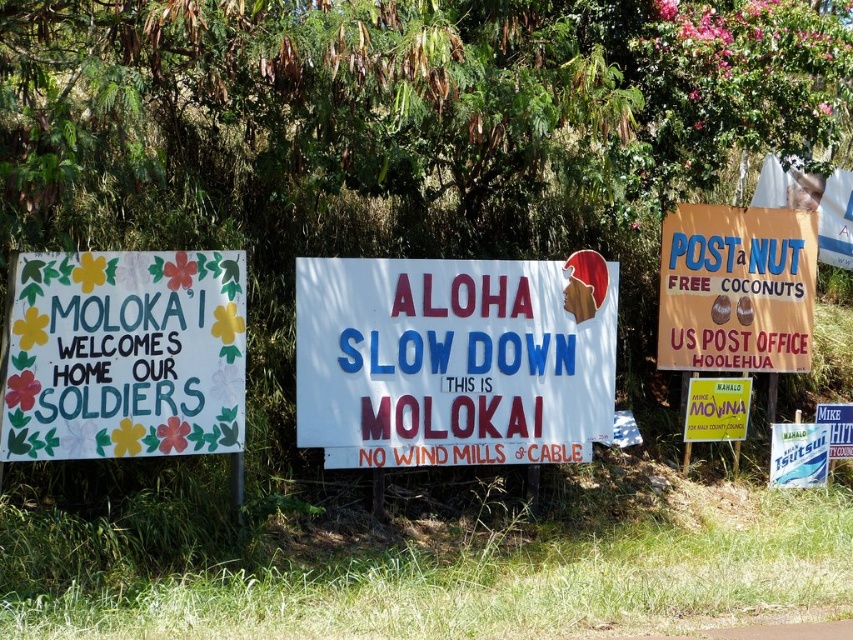
Question: Which of these objects is positioned farthest from the yellow paper sign at center?

Choices:
 (A) white paper sign at center
 (B) white plastic sign at lower right
 (C) blue cardboard sign at right
 (D) matte floral signboard at left

Answer: (D)

Question: Can you confirm if white paper sign at center is positioned above yellow paper sign at center?

Choices:
 (A) yes
 (B) no

Answer: (A)

Question: Can you confirm if blue cardboard sign at right is positioned to the right of white plastic sign at lower right?

Choices:
 (A) yes
 (B) no

Answer: (B)

Question: Which is farther from the white paper sign at center?

Choices:
 (A) yellow paper sign at center
 (B) white plastic sign at lower right

Answer: (B)

Question: Does matte floral signboard at left have a larger size compared to yellow paper sign at center?

Choices:
 (A) no
 (B) yes

Answer: (B)

Question: Which point is farther to the camera?

Choices:
 (A) blue cardboard sign at right
 (B) white paper sign at center
 (C) white plastic sign at lower right
 (D) matte floral signboard at left

Answer: (C)